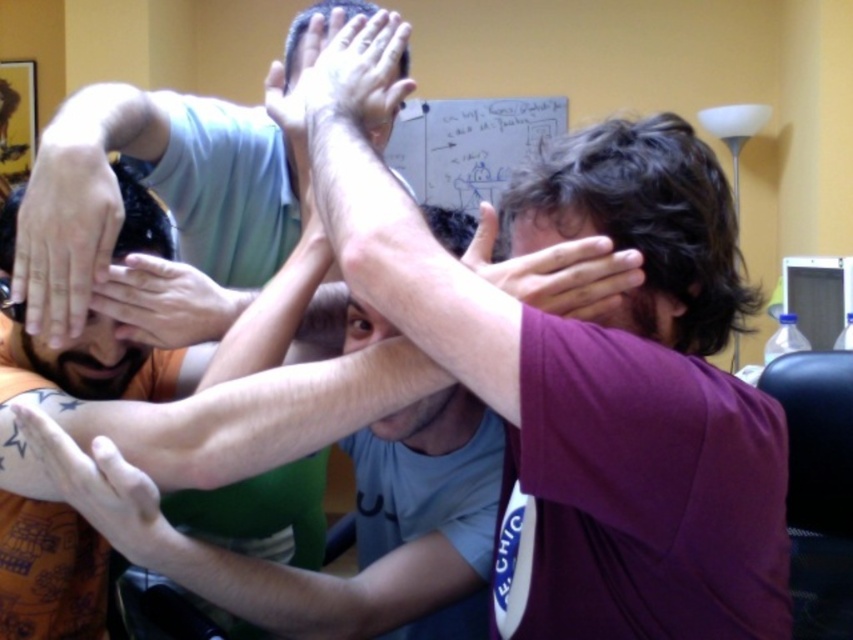
Question: Which of the following is the farthest from the observer?

Choices:
 (A) pos(144,326)
 (B) pos(384,120)
 (C) pos(608,240)

Answer: (B)

Question: Estimate the real-world distances between objects in this image. Which object is closer to the black matte hair at center?

Choices:
 (A) matte skin hand at upper center
 (B) tattooed skin at center
 (C) purple matte hand at center
 (D) tattooed skin at lower left

Answer: (D)

Question: Is purple matte hand at center above matte skin hand at upper center?

Choices:
 (A) yes
 (B) no

Answer: (B)

Question: Is purple matte hand at center to the right of tattooed skin at lower left from the viewer's perspective?

Choices:
 (A) no
 (B) yes

Answer: (B)

Question: Can you confirm if matte skin hand at center is wider than tattooed skin at lower left?

Choices:
 (A) no
 (B) yes

Answer: (A)

Question: Which of the following is the closest to the observer?

Choices:
 (A) purple matte hand at center
 (B) matte skin hand at center

Answer: (A)